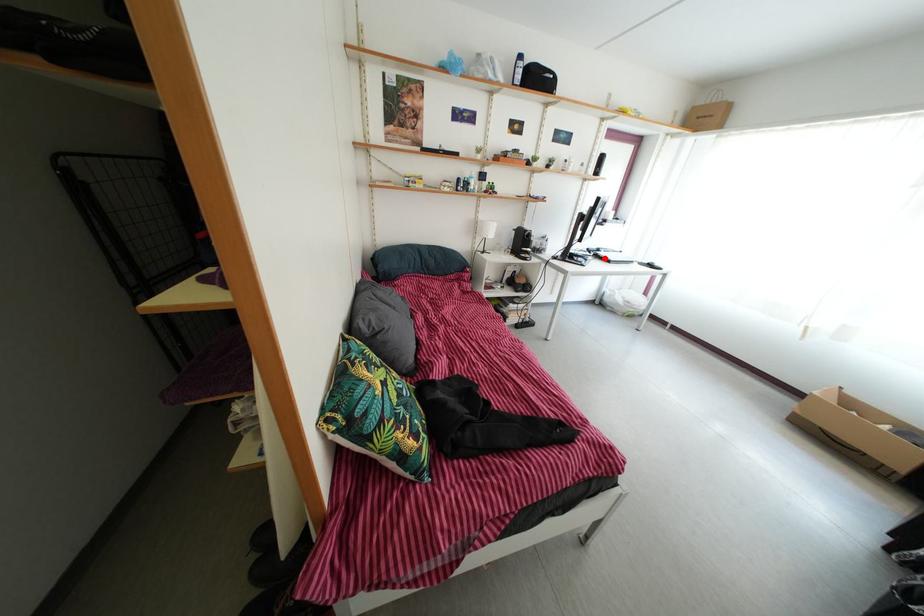
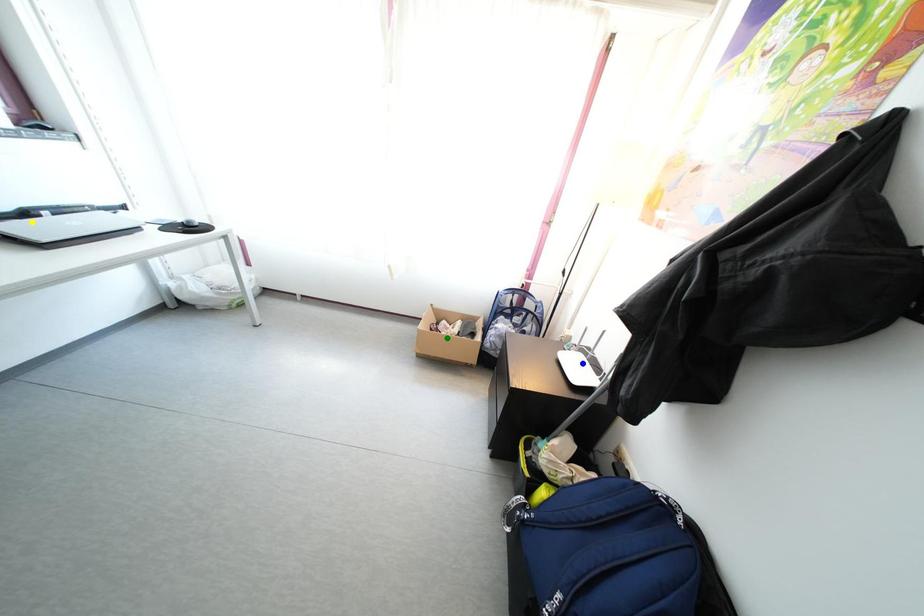
Question: I am providing you with two images of the same scene from different viewpoints. A red point is marked on the first image. You are given multiple points on the second image. In image 2, which mark is for the same physical point as the one in image 1?

Choices:
 (A) green point
 (B) yellow point
 (C) blue point

Answer: (B)